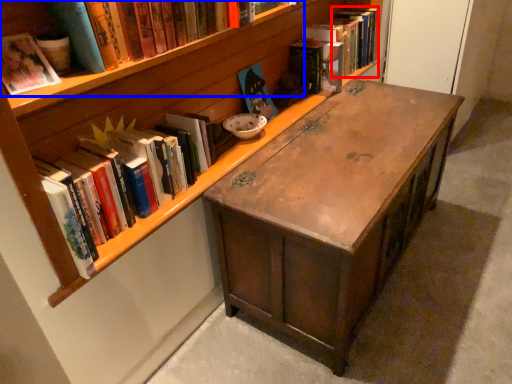
Question: Which of the following is the closest to the observer, book (highlighted by a red box) or book (highlighted by a blue box)?

Choices:
 (A) book
 (B) book

Answer: (B)